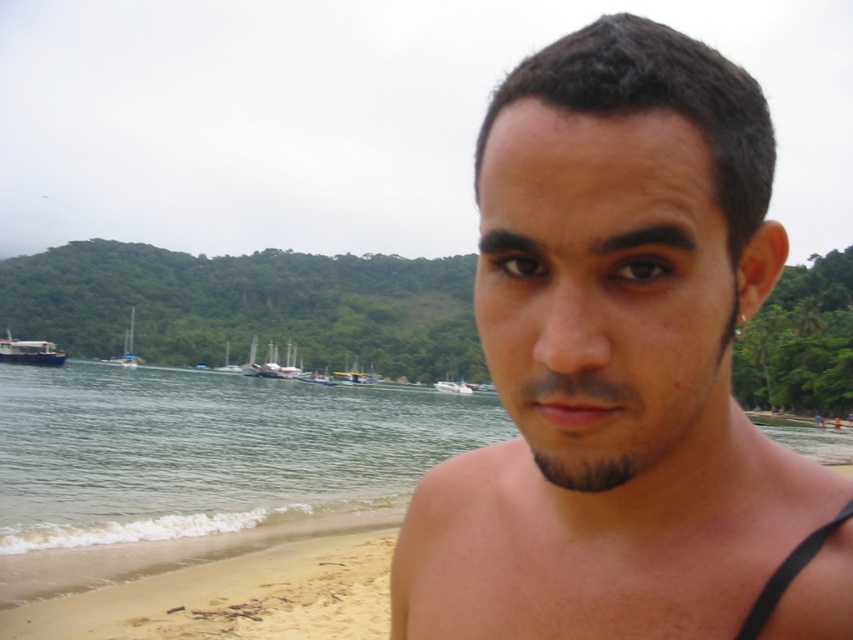
Question: Considering the relative positions of brown matte skin at center and green water at lower left in the image provided, where is brown matte skin at center located with respect to green water at lower left?

Choices:
 (A) left
 (B) right

Answer: (B)

Question: Can you confirm if green water at lower left is wider than white glossy sailboat at center?

Choices:
 (A) yes
 (B) no

Answer: (A)

Question: Which of the following is the closest to the observer?

Choices:
 (A) coord(355,358)
 (B) coord(10,353)
 (C) coord(563,614)
 (D) coord(462,381)

Answer: (C)

Question: Which of these objects is positioned closest to the white glossy sailboat at center?

Choices:
 (A) green water at lower left
 (B) wooden sailboat at center
 (C) blue glossy boat at left
 (D) white glossy boat at center

Answer: (B)

Question: Does white glossy sailboat at lower left appear on the left side of white glossy sailboat at center?

Choices:
 (A) no
 (B) yes

Answer: (B)

Question: Estimate the real-world distances between objects in this image. Which object is closer to the blue glossy boat at left?

Choices:
 (A) white plastic boat at center
 (B) brown matte skin at center
 (C) white glossy sailboat at lower left
 (D) light tan sand at lower left

Answer: (C)